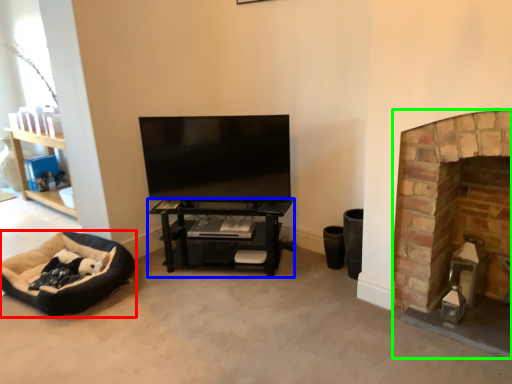
Question: Based on their relative distances, which object is nearer to dog bed (highlighted by a red box)? Choose from shelf (highlighted by a blue box) and fireplace (highlighted by a green box).

Choices:
 (A) shelf
 (B) fireplace

Answer: (A)